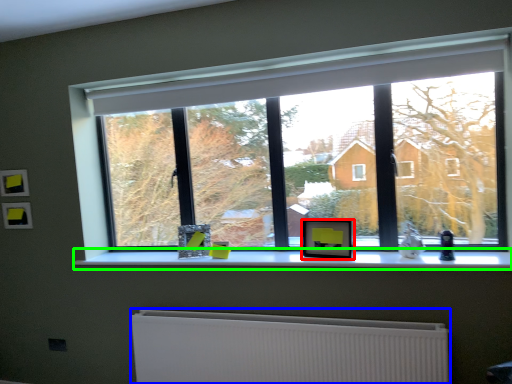
Question: Which object is the farthest from picture frame (highlighted by a red box)? Choose among these: radiator (highlighted by a blue box) or window sill (highlighted by a green box).

Choices:
 (A) radiator
 (B) window sill

Answer: (A)